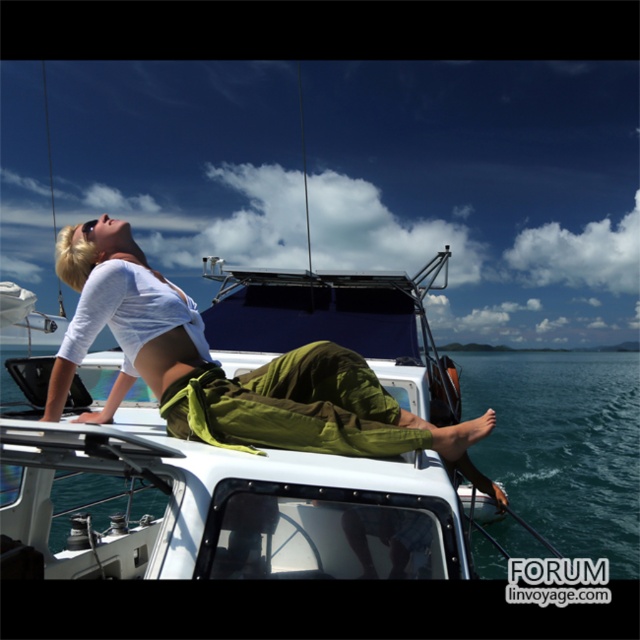
Question: Which point is closer to the camera?

Choices:
 (A) (189, 374)
 (B) (474, 404)

Answer: (A)

Question: Is matte white shirt at upper left wider than clear blue water at upper center?

Choices:
 (A) yes
 (B) no

Answer: (B)

Question: Is matte white shirt at upper left above clear blue water at upper center?

Choices:
 (A) yes
 (B) no

Answer: (A)

Question: Which object is farther from the camera taking this photo?

Choices:
 (A) clear blue water at upper center
 (B) matte white shirt at upper left

Answer: (A)

Question: Does matte white shirt at upper left have a larger size compared to clear blue water at upper center?

Choices:
 (A) yes
 (B) no

Answer: (B)